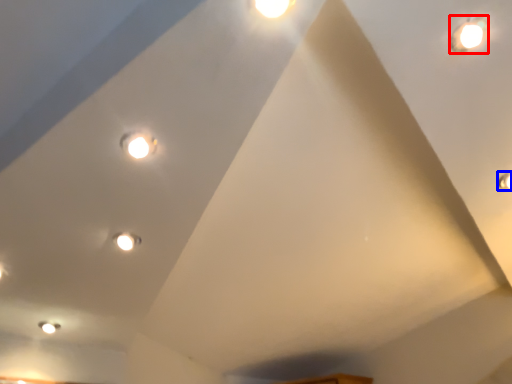
Question: Which of the following is the closest to the observer, droplight (highlighted by a red box) or light (highlighted by a blue box)?

Choices:
 (A) droplight
 (B) light

Answer: (A)